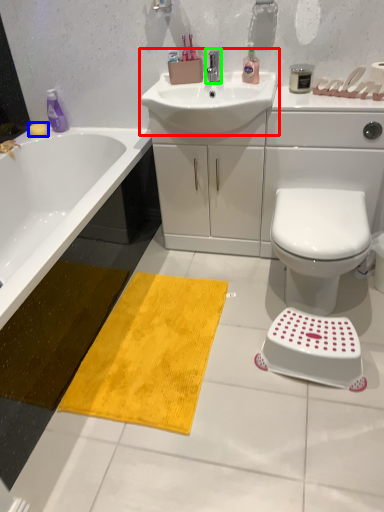
Question: Which object is the farthest from sink (highlighted by a red box)? Choose among these: soap (highlighted by a blue box) or tap (highlighted by a green box).

Choices:
 (A) soap
 (B) tap

Answer: (A)